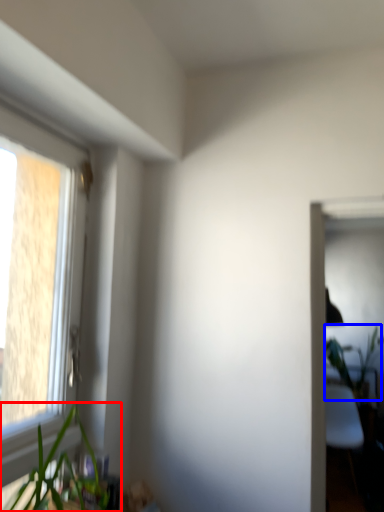
Question: Which object appears farthest to the camera in this image, houseplant (highlighted by a red box) or vegetation (highlighted by a blue box)?

Choices:
 (A) houseplant
 (B) vegetation

Answer: (B)